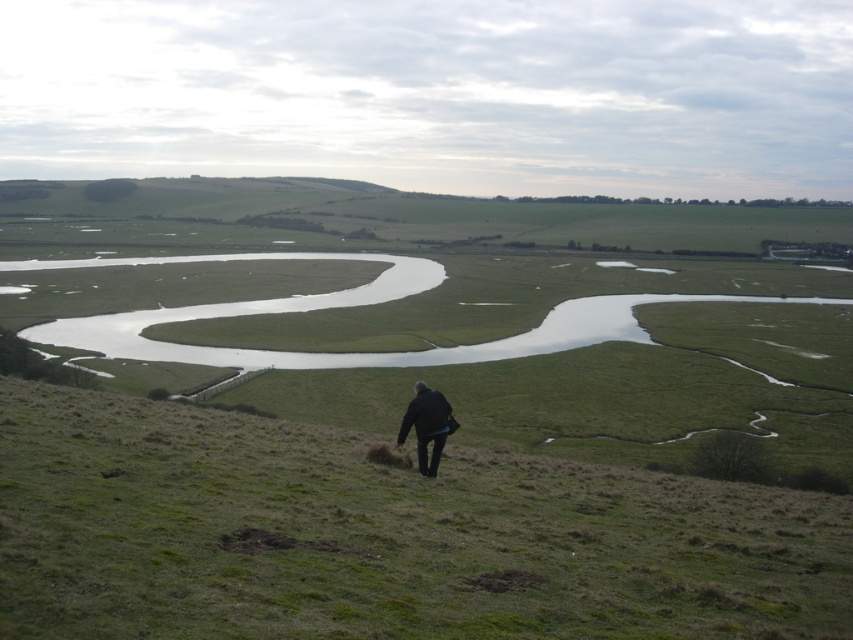
Question: Can you confirm if green grassy hillside at lower center is thinner than black matte jacket at center?

Choices:
 (A) yes
 (B) no

Answer: (B)

Question: Among these points, which one is nearest to the camera?

Choices:
 (A) click(x=334, y=602)
 (B) click(x=454, y=420)

Answer: (A)

Question: Which object appears closest to the camera in this image?

Choices:
 (A) green grassy hillside at lower center
 (B) black matte jacket at center

Answer: (A)

Question: Is green grassy hillside at lower center bigger than black matte jacket at center?

Choices:
 (A) yes
 (B) no

Answer: (A)

Question: Is green grassy hillside at lower center thinner than black matte jacket at center?

Choices:
 (A) yes
 (B) no

Answer: (B)